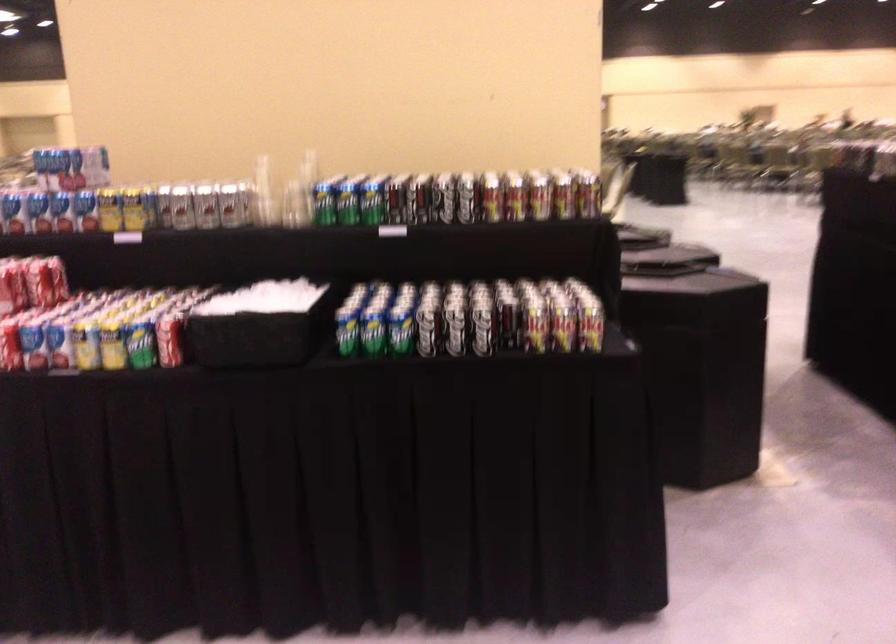
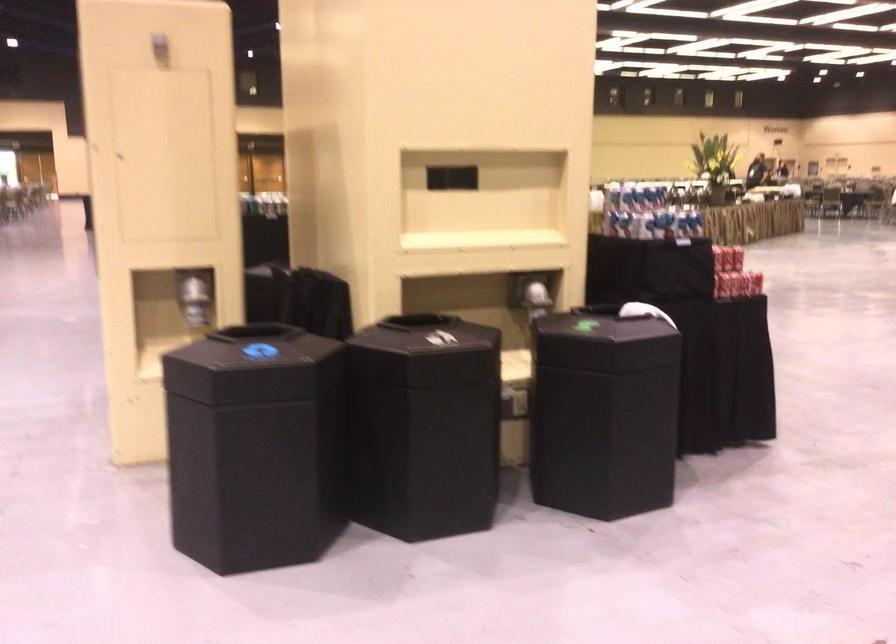
Question: I am providing you with two images of the same scene from different viewpoints. Which of the following objects are not visible in image2?

Choices:
 (A) utility cart handle
 (B) silver soda can
 (C) black bin lid
 (D) shiny dispenser lever

Answer: (B)